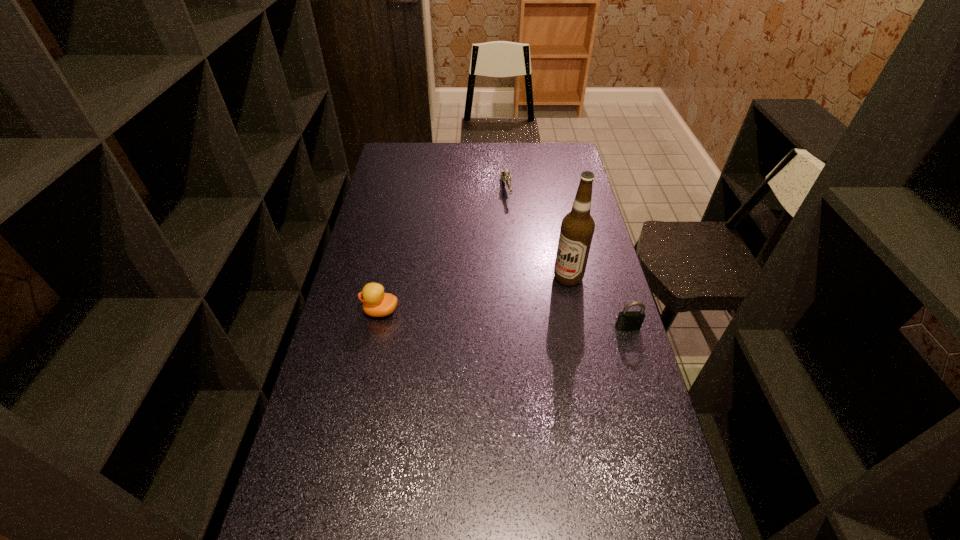
The height and width of the screenshot is (540, 960). Identify the location of duckling. (376, 303).

I want to click on the leftmost object, so click(x=376, y=303).

This screenshot has height=540, width=960. Identify the location of the nearest object. (627, 320).

This screenshot has width=960, height=540. Identify the location of the rightmost object. (627, 320).

At what (x,y) coordinates should I click in order to perform the action: click on the second farthest object. Please return your answer as a coordinate pair (x, y). Image resolution: width=960 pixels, height=540 pixels. Looking at the image, I should click on (577, 228).

Where is `the tallest object`? the tallest object is located at coordinates click(577, 228).

Identify the location of the farthest object. (505, 175).

Locate an element on the screen. This screenshot has width=960, height=540. the second object from left to right is located at coordinates (505, 175).

You are a GUI agent. You are given a task and a screenshot of the screen. Output one action in this format:
    pyautogui.click(x=<x>, y=<y>)
    Task: Click on the vacant area located 0.050m on the face of the leftmost object
    This screenshot has width=960, height=540.
    Given the screenshot: What is the action you would take?
    pyautogui.click(x=347, y=311)

What are the coordinates of `free spot located on the left of the nearest object` in the screenshot? It's located at (528, 327).